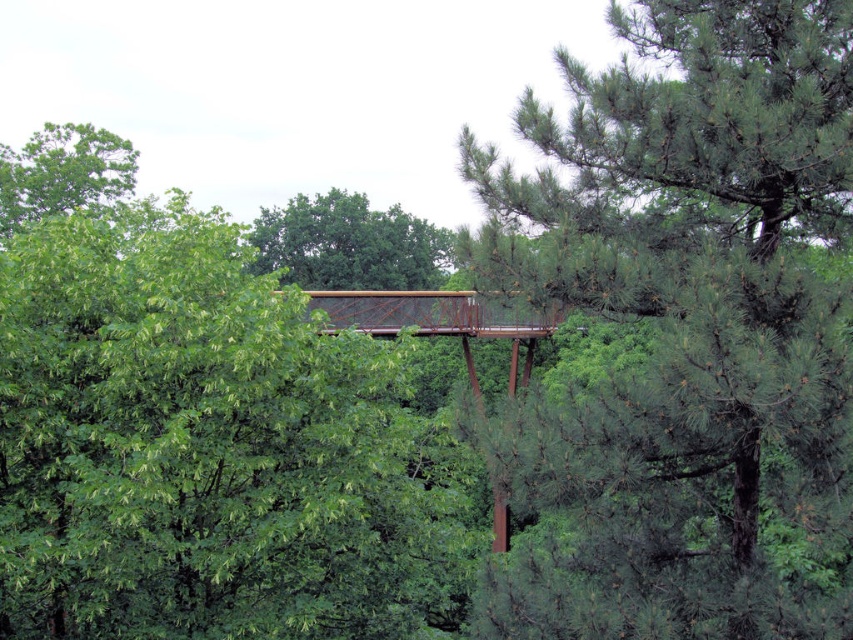
Which is below, green pine tree at center or green matte tree at center?

green pine tree at center is below.

Which of these two, green pine tree at center or green matte tree at center, stands shorter?

green pine tree at center is shorter.

Find the location of a particular element. Image resolution: width=853 pixels, height=640 pixels. green pine tree at center is located at coordinates (688, 330).

Is green pine tree at center shorter than green leafy tree at upper left?

Indeed, green pine tree at center has a lesser height compared to green leafy tree at upper left.

Does green pine tree at center have a lesser width compared to green leafy tree at upper left?

Yes, green pine tree at center is thinner than green leafy tree at upper left.

Between point (656, 392) and point (117, 148), which one is positioned in front?

Point (656, 392)

I want to click on green pine tree at center, so click(x=688, y=330).

In the scene shown: Can you confirm if green matte tree at center is positioned above green leafy tree at upper left?

Actually, green matte tree at center is below green leafy tree at upper left.

Which is more to the right, green matte tree at center or green leafy tree at upper left?

From the viewer's perspective, green matte tree at center appears more on the right side.

Does point (264, 240) lie in front of point (88, 144)?

No.

Find the location of a particular element. The image size is (853, 640). green matte tree at center is located at coordinates (349, 244).